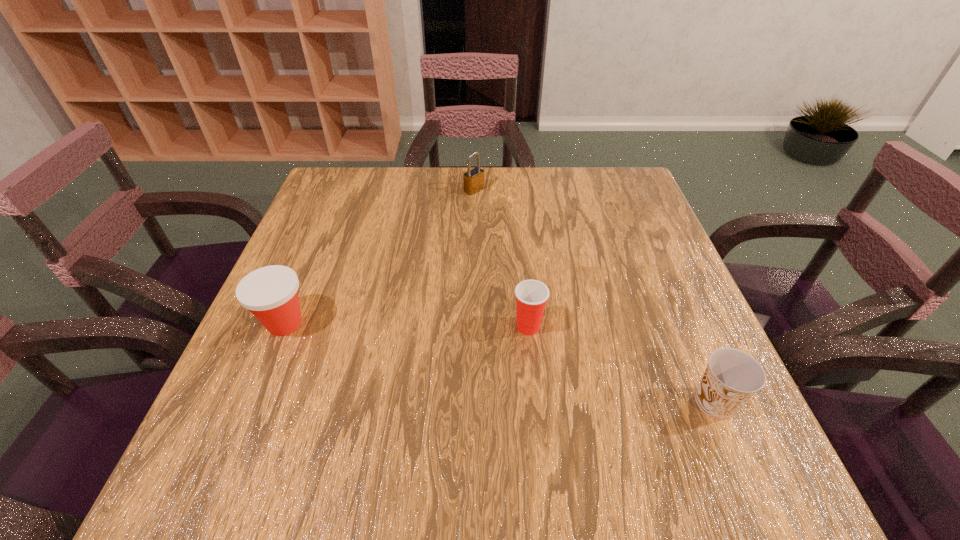
In order to click on object that is at the far edge in this screenshot , I will do point(473,180).

What are the coordinates of `object that is at the left edge` in the screenshot? It's located at tap(270, 293).

I want to click on object positioned at the right edge, so (x=732, y=377).

In the image, there is a desktop. Find the location of `vacant region at the far edge`. vacant region at the far edge is located at coordinates (421, 169).

In the image, there is a desktop. At what (x,y) coordinates should I click in order to perform the action: click on free space at the near edge. Please return your answer as a coordinate pair (x, y). Looking at the image, I should click on (636, 460).

The image size is (960, 540). In order to click on vacant space at the left edge of the desktop in this screenshot , I will do `click(342, 217)`.

You are a GUI agent. You are given a task and a screenshot of the screen. Output one action in this format:
    pyautogui.click(x=<x>, y=<y>)
    Task: Click on the free spot at the right edge of the desktop
    
    Given the screenshot: What is the action you would take?
    pyautogui.click(x=666, y=426)

You are a GUI agent. You are given a task and a screenshot of the screen. Output one action in this format:
    pyautogui.click(x=<x>, y=<y>)
    Task: Click on the vacant space at the far left corner of the desktop
    The image size is (960, 540).
    Given the screenshot: What is the action you would take?
    pyautogui.click(x=320, y=193)

You are a GUI agent. You are given a task and a screenshot of the screen. Output one action in this format:
    pyautogui.click(x=<x>, y=<y>)
    Task: Click on the vacant space that is in between the nearest Dixie cup and the third object from left to right
    The image size is (960, 540).
    Given the screenshot: What is the action you would take?
    pyautogui.click(x=621, y=364)

Find the location of a particular element. free space between the nearest Dixie cup and the leftmost object is located at coordinates point(499,363).